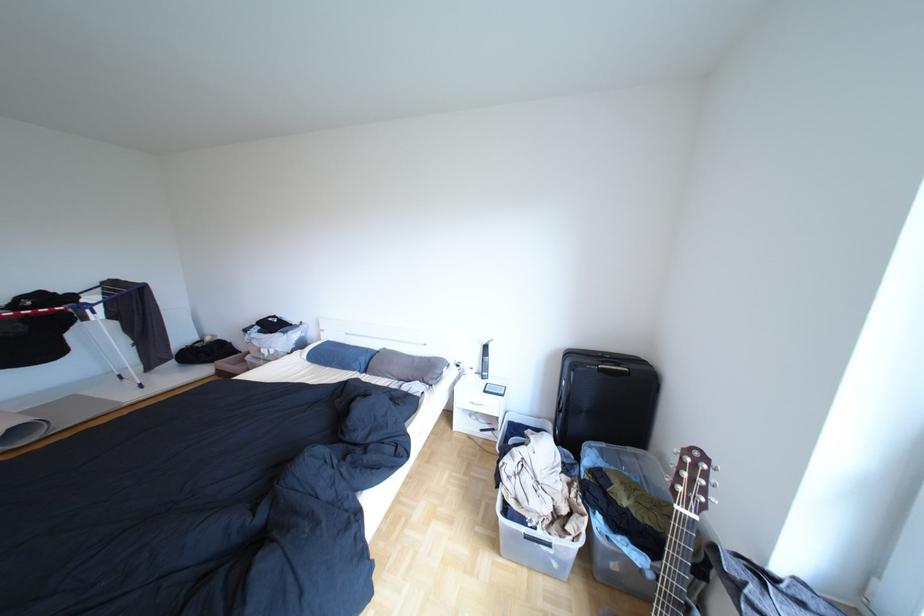
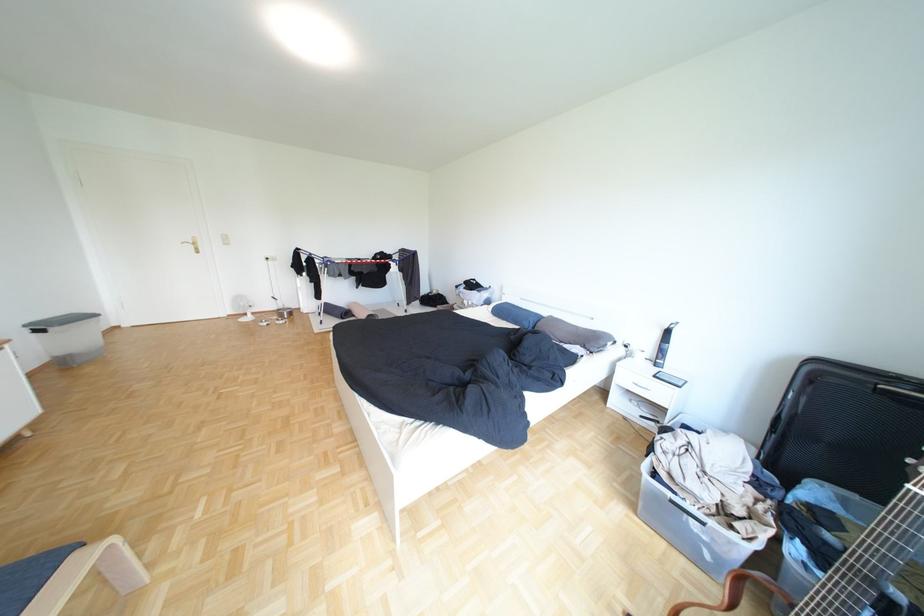
Question: I am providing you with two images of the same scene from different viewpoints. Please identify which objects are invisible in image2.

Choices:
 (A) grey pillow
 (B) black suitcase handle
 (C) blue pillow
 (D) none of these

Answer: (D)